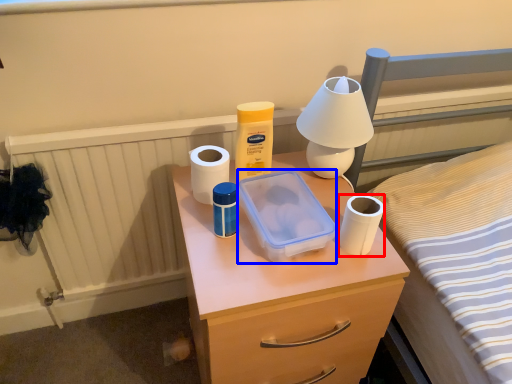
Question: Which point is further to the camera, toilet paper (highlighted by a red box) or storage box (highlighted by a blue box)?

Choices:
 (A) toilet paper
 (B) storage box

Answer: (A)